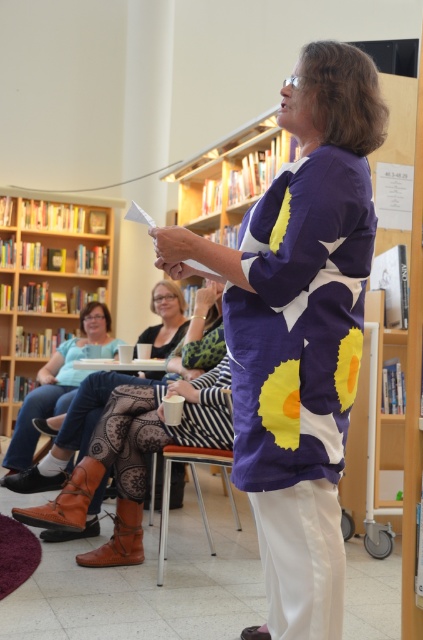
Question: Which object is positioned closest to the wooden bookcase at upper left?

Choices:
 (A) metallic silver chair at center
 (B) jeans at lower left

Answer: (B)

Question: Is jeans at lower left behind metallic silver chair at center?

Choices:
 (A) no
 (B) yes

Answer: (B)

Question: Which of these objects is positioned farthest from the metallic silver chair at center?

Choices:
 (A) jeans at lower left
 (B) wooden bookcase at upper left

Answer: (B)

Question: Can you confirm if jeans at lower left is smaller than metallic silver chair at center?

Choices:
 (A) no
 (B) yes

Answer: (A)

Question: Observing the image, what is the correct spatial positioning of wooden bookcase at upper left in reference to jeans at lower left?

Choices:
 (A) above
 (B) below

Answer: (A)

Question: Which of the following is the farthest from the observer?

Choices:
 (A) jeans at lower left
 (B) metallic silver chair at center
 (C) wooden bookcase at upper left

Answer: (C)